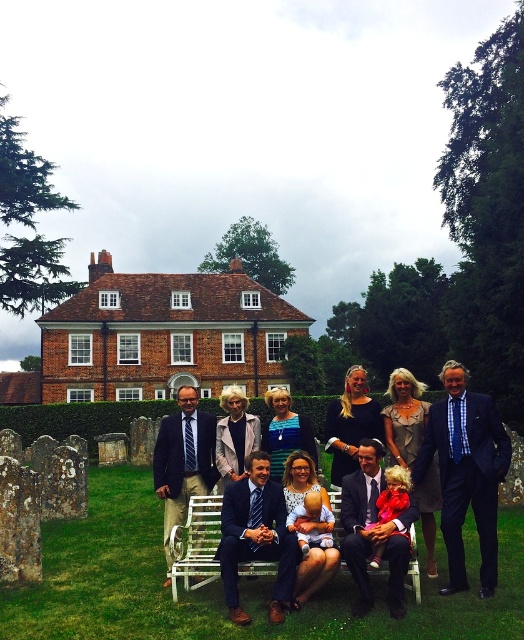
Between dark blue suit at center and white wood bench at center, which one is positioned higher?

Positioned higher is dark blue suit at center.

Describe the element at coordinates (468, 481) in the screenshot. I see `dark blue suit at center` at that location.

Identify the location of dark blue suit at center. This screenshot has height=640, width=524. (468, 481).